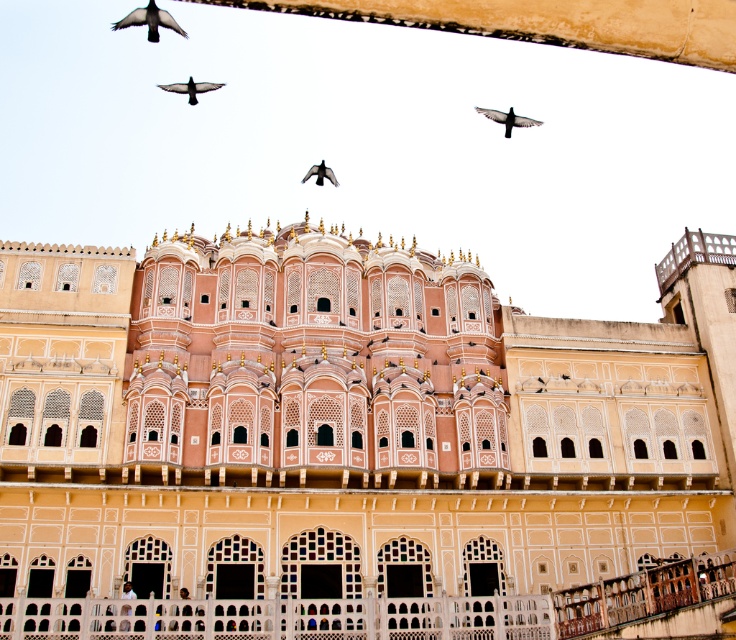
Consider the image. Does black feathered bird at upper left have a greater height compared to dark gray feathered bird at upper center?

Indeed, black feathered bird at upper left has a greater height compared to dark gray feathered bird at upper center.

The height and width of the screenshot is (640, 736). What do you see at coordinates (149, 20) in the screenshot? I see `black feathered bird at upper left` at bounding box center [149, 20].

Image resolution: width=736 pixels, height=640 pixels. What do you see at coordinates (149, 20) in the screenshot? I see `black feathered bird at upper left` at bounding box center [149, 20].

Locate an element on the screen. The image size is (736, 640). black feathered bird at upper left is located at coordinates (149, 20).

Is beige stone palace at center thinner than dark gray feathered bird at upper center?

No, beige stone palace at center is not thinner than dark gray feathered bird at upper center.

Who is more distant from viewer, (523, 326) or (185, 84)?

The point (185, 84) is more distant.

The image size is (736, 640). Find the location of `beige stone palace at center`. beige stone palace at center is located at coordinates (353, 444).

Is black matte bird at upper center wider than dark gray feathered bird at upper center?

In fact, black matte bird at upper center might be narrower than dark gray feathered bird at upper center.

Who is shorter, black matte bird at upper center or dark gray feathered bird at upper center?

With less height is dark gray feathered bird at upper center.

The width and height of the screenshot is (736, 640). In order to click on black matte bird at upper center in this screenshot , I will do `click(506, 118)`.

At what (x,y) coordinates should I click in order to perform the action: click on black matte bird at upper center. Please return your answer as a coordinate pair (x, y). Looking at the image, I should click on (506, 118).